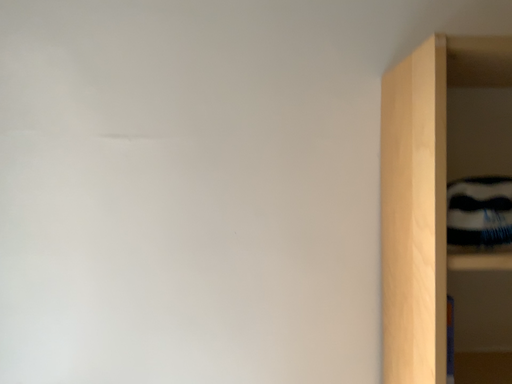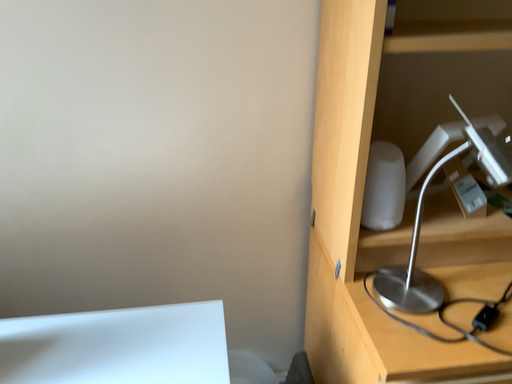
Question: Which way did the camera rotate in the video?

Choices:
 (A) rotated left
 (B) rotated right

Answer: (B)